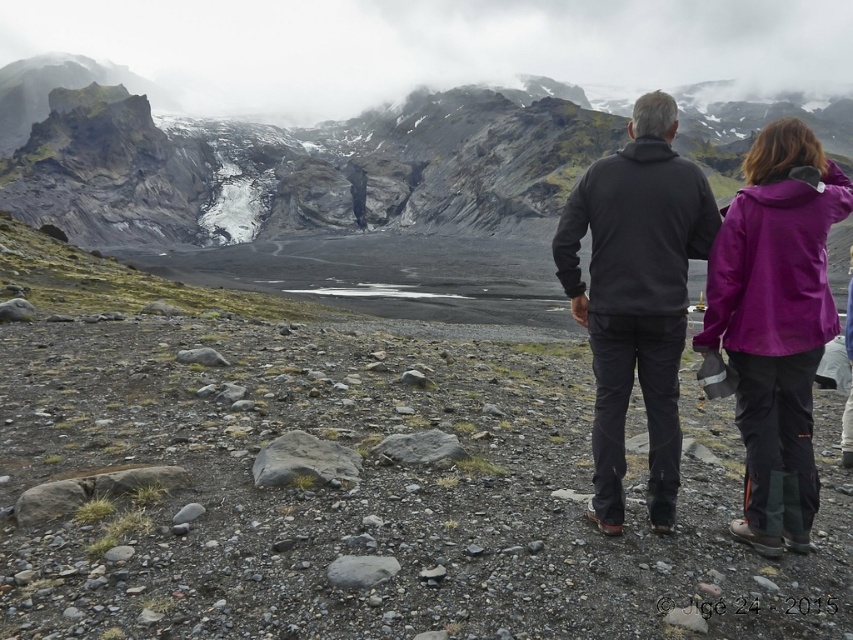
You are planning to hike across the rugged rock mountain at upper center and need to pass by the purple waterproof jacket at upper right. Based on the image, which direction should you head relative to the jacket to reach the mountain?

The rugged rock mountain at upper center is above the purple waterproof jacket at upper right, so you should head north towards the mountain from the jacket.

You are a hiker planning to cross the rugged rock mountain at upper center and the purple waterproof jacket at upper right is your gear. Which object is located to the right of the other?

The rugged rock mountain at upper center is positioned on the right side of purple waterproof jacket at upper right, so the rugged rock mountain at upper center is to the right of the purple waterproof jacket at upper right.

Based on the photo, you are planning to take a photo of the rugged rock mountain at upper center and the dark gray fleece jacket at center. Which object should you focus on first if you want both to be in sharp focus?

The rugged rock mountain at upper center should be focused on first because the dark gray fleece jacket at center is behind it, ensuring both will be in focus by focusing on the foreground object.